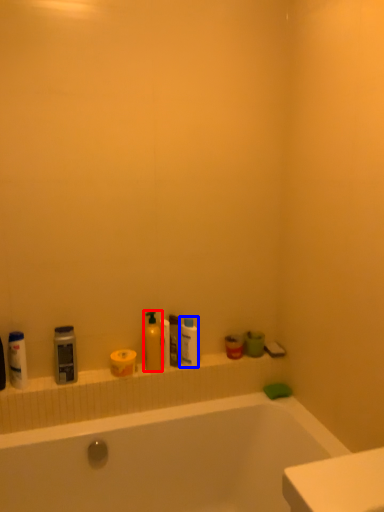
Question: Which of the following is the closest to the observer, cleaning product (highlighted by a red box) or toiletry (highlighted by a blue box)?

Choices:
 (A) cleaning product
 (B) toiletry

Answer: (A)